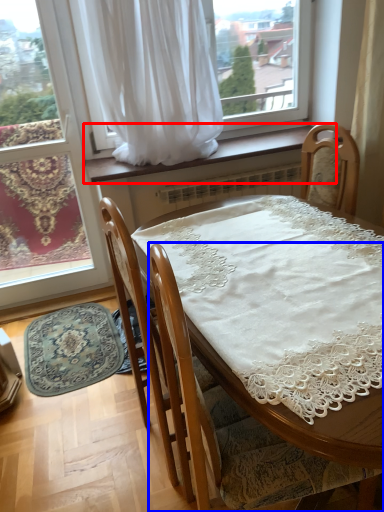
Question: Which object is closer to the camera taking this photo, window sill (highlighted by a red box) or chair (highlighted by a blue box)?

Choices:
 (A) window sill
 (B) chair

Answer: (B)